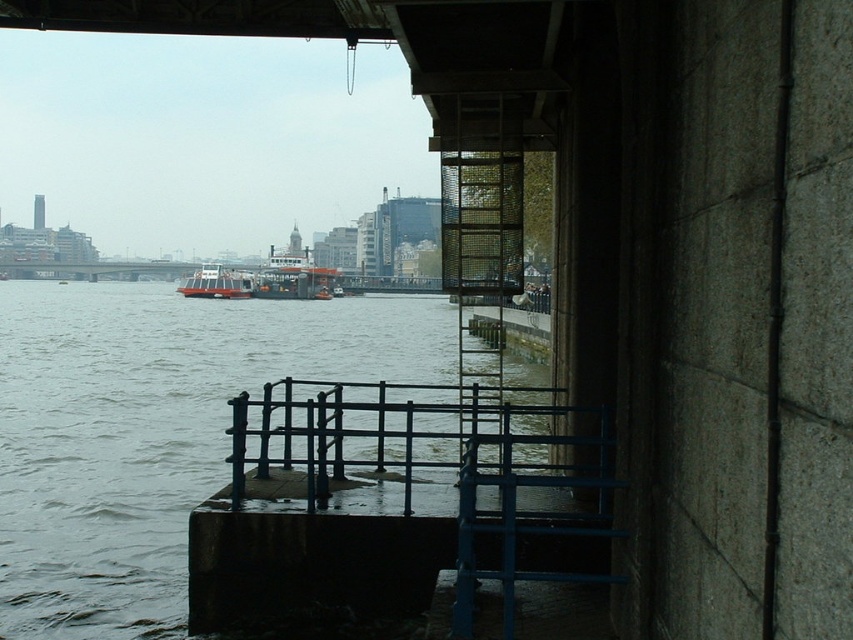
Question: Which object is closer to the camera taking this photo?

Choices:
 (A) orange matte ferry at center
 (B) red matte boat at center

Answer: (B)

Question: Is orange matte ferry at center bigger than red matte boat at center?

Choices:
 (A) no
 (B) yes

Answer: (A)

Question: Can you confirm if blue metal dock at lower center is thinner than red matte boat at center?

Choices:
 (A) yes
 (B) no

Answer: (A)

Question: Which object is the farthest from the red matte boat at center?

Choices:
 (A) blue metal rail at center
 (B) orange matte ferry at center
 (C) blue metal dock at lower center
 (D) gray concrete water at lower left

Answer: (C)

Question: Does orange matte ferry at center appear on the right side of red matte boat at center?

Choices:
 (A) yes
 (B) no

Answer: (A)

Question: Based on their relative distances, which object is farther from the red matte boat at center?

Choices:
 (A) orange matte ferry at center
 (B) gray concrete water at lower left
 (C) blue metal dock at lower center

Answer: (C)